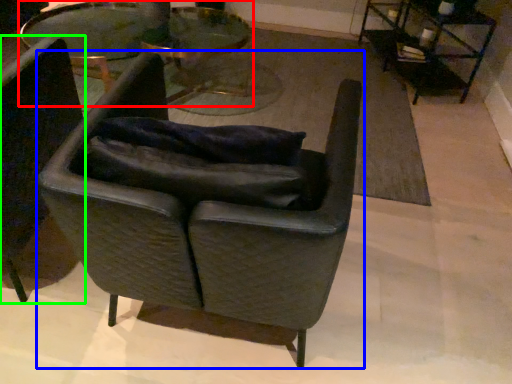
Question: Estimate the real-world distances between objects in this image. Which object is closer to table (highlighted by a red box), chair (highlighted by a blue box) or chair (highlighted by a green box)?

Choices:
 (A) chair
 (B) chair

Answer: (B)